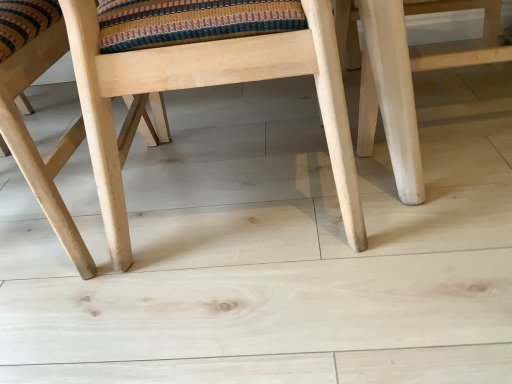
At what (x,y) coordinates should I click in order to perform the action: click on natural wood chair at center, which ranks as the 1th chair in left-to-right order. Please return your answer as a coordinate pair (x, y). Looking at the image, I should click on (25, 101).

Describe the element at coordinates (25, 101) in the screenshot. I see `natural wood chair at center, which ranks as the 1th chair in left-to-right order` at that location.

Describe the element at coordinates (202, 86) in the screenshot. I see `natural wood chair at center, the second chair from the left` at that location.

Locate an element on the screen. This screenshot has height=384, width=512. natural wood chair at center, which is the 1th chair from right to left is located at coordinates (202, 86).

Identify the location of natural wood chair at center, which ranks as the 1th chair in left-to-right order. (25, 101).

Visually, is natural wood chair at center, which ranks as the 1th chair in left-to-right order, positioned to the left or to the right of natural wood chair at center, the second chair from the left?

In the image, natural wood chair at center, which ranks as the 1th chair in left-to-right order, appears on the left side of natural wood chair at center, the second chair from the left.

Does natural wood chair at center, the 2th chair viewed from the right, come behind natural wood chair at center, the second chair from the left?

Yes, it is.

Considering the points (11, 121) and (78, 64), which point is behind, point (11, 121) or point (78, 64)?

The point (11, 121) is farther from the camera.

From the image's perspective, does natural wood chair at center, the 2th chair viewed from the right, appear lower than natural wood chair at center, which is the 1th chair from right to left?

Correct, natural wood chair at center, the 2th chair viewed from the right, appears lower than natural wood chair at center, which is the 1th chair from right to left, in the image.

From a real-world perspective, relative to natural wood chair at center, which is the 1th chair from right to left, is natural wood chair at center, which ranks as the 1th chair in left-to-right order, vertically above or below?

From a real-world perspective, natural wood chair at center, which ranks as the 1th chair in left-to-right order, is physically below natural wood chair at center, which is the 1th chair from right to left.

Can you confirm if natural wood chair at center, which ranks as the 1th chair in left-to-right order, is wider than natural wood chair at center, which is the 1th chair from right to left?

Yes, natural wood chair at center, which ranks as the 1th chair in left-to-right order, is wider than natural wood chair at center, which is the 1th chair from right to left.

Who is taller, natural wood chair at center, the 2th chair viewed from the right, or natural wood chair at center, which is the 1th chair from right to left?

Standing taller between the two is natural wood chair at center, which is the 1th chair from right to left.

Does natural wood chair at center, the 2th chair viewed from the right, have a larger size compared to natural wood chair at center, the second chair from the left?

No, natural wood chair at center, the 2th chair viewed from the right, is not bigger than natural wood chair at center, the second chair from the left.

Is natural wood chair at center, which is the 1th chair from right to left, completely or partially inside natural wood chair at center, which ranks as the 1th chair in left-to-right order?

No.

Is natural wood chair at center, which ranks as the 1th chair in left-to-right order, not close to natural wood chair at center, the second chair from the left?

That's not correct — natural wood chair at center, which ranks as the 1th chair in left-to-right order, is a little close to natural wood chair at center, the second chair from the left.

From the picture: Is natural wood chair at center, the second chair from the left, at the back of natural wood chair at center, which ranks as the 1th chair in left-to-right order?

natural wood chair at center, which ranks as the 1th chair in left-to-right order, is not turned away from natural wood chair at center, the second chair from the left.

Measure the distance between natural wood chair at center, the 2th chair viewed from the right, and natural wood chair at center, which is the 1th chair from right to left.

natural wood chair at center, the 2th chair viewed from the right, is 7.02 inches from natural wood chair at center, which is the 1th chair from right to left.

Locate an element on the screen. This screenshot has width=512, height=384. chair above the natural wood chair at center, which ranks as the 1th chair in left-to-right order (from the image's perspective) is located at coordinates (202, 86).

Can you confirm if natural wood chair at center, the second chair from the left, is positioned to the right of natural wood chair at center, the 2th chair viewed from the right?

Indeed, natural wood chair at center, the second chair from the left, is positioned on the right side of natural wood chair at center, the 2th chair viewed from the right.

Does natural wood chair at center, the second chair from the left, come behind natural wood chair at center, which ranks as the 1th chair in left-to-right order?

No, it is in front of natural wood chair at center, which ranks as the 1th chair in left-to-right order.

Is point (311, 18) behind point (82, 251)?

No, it is not.

From the image's perspective, who appears lower, natural wood chair at center, the second chair from the left, or natural wood chair at center, the 2th chair viewed from the right?

natural wood chair at center, the 2th chair viewed from the right, is shown below in the image.

From a real-world perspective, which is physically above, natural wood chair at center, the second chair from the left, or natural wood chair at center, which ranks as the 1th chair in left-to-right order?

natural wood chair at center, the second chair from the left, from a real-world perspective.

Looking at their sizes, would you say natural wood chair at center, which is the 1th chair from right to left, is wider or thinner than natural wood chair at center, the 2th chair viewed from the right?

In the image, natural wood chair at center, which is the 1th chair from right to left, appears to be more narrow than natural wood chair at center, the 2th chair viewed from the right.

Is natural wood chair at center, the second chair from the left, shorter than natural wood chair at center, the 2th chair viewed from the right?

No, natural wood chair at center, the second chair from the left, is not shorter than natural wood chair at center, the 2th chair viewed from the right.

Is natural wood chair at center, the second chair from the left, bigger or smaller than natural wood chair at center, which ranks as the 1th chair in left-to-right order?

Clearly, natural wood chair at center, the second chair from the left, is larger in size than natural wood chair at center, which ranks as the 1th chair in left-to-right order.

Is natural wood chair at center, which is the 1th chair from right to left, outside of natural wood chair at center, the 2th chair viewed from the right?

natural wood chair at center, which is the 1th chair from right to left, lies outside natural wood chair at center, the 2th chair viewed from the right,'s area.

Is natural wood chair at center, which is the 1th chair from right to left, in contact with natural wood chair at center, which ranks as the 1th chair in left-to-right order?

natural wood chair at center, which is the 1th chair from right to left, and natural wood chair at center, which ranks as the 1th chair in left-to-right order, are not in contact.

Is natural wood chair at center, which ranks as the 1th chair in left-to-right order, at the back of natural wood chair at center, the second chair from the left?

No, natural wood chair at center, the second chair from the left, is not facing away from natural wood chair at center, which ranks as the 1th chair in left-to-right order.

You are a GUI agent. You are given a task and a screenshot of the screen. Output one action in this format:
    pyautogui.click(x=<x>, y=<y>)
    Task: Click on the chair in front of the natural wood chair at center, the 2th chair viewed from the right
    This screenshot has height=384, width=512.
    Given the screenshot: What is the action you would take?
    pyautogui.click(x=202, y=86)

At what (x,y) coordinates should I click in order to perform the action: click on chair on the left side of natural wood chair at center, which is the 1th chair from right to left. Please return your answer as a coordinate pair (x, y). The image size is (512, 384). Looking at the image, I should click on (25, 101).

You are a GUI agent. You are given a task and a screenshot of the screen. Output one action in this format:
    pyautogui.click(x=<x>, y=<y>)
    Task: Click on the chair below the natural wood chair at center, the second chair from the left (from the image's perspective)
    
    Given the screenshot: What is the action you would take?
    pyautogui.click(x=25, y=101)